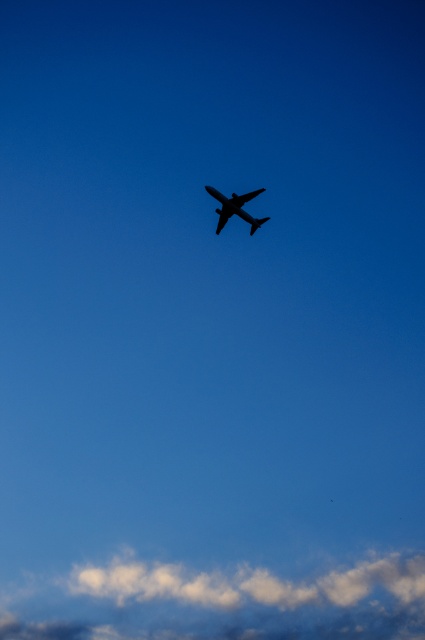
You are an airplane pilot flying the black matte airplane at center. You need to avoid the white fluffy cloud at lower center. Is the cloud bigger than your airplane?

The white fluffy cloud at lower center is larger in size than the black matte airplane at center, so yes, the cloud is bigger than the airplane.

You are an airplane pilot flying a commercial jet at an altitude of 10,000 feet. You notice the white fluffy cloud at lower center in your view. Based on its 2D coordinates, can you estimate whether this cloud is directly below your current flight path or ahead of it?

→ The white fluffy cloud at lower center is located at coordinates (221, 602). Since the airplane is flying diagonally from the bottom left to the top right, the cloud is positioned ahead of the current flight path.